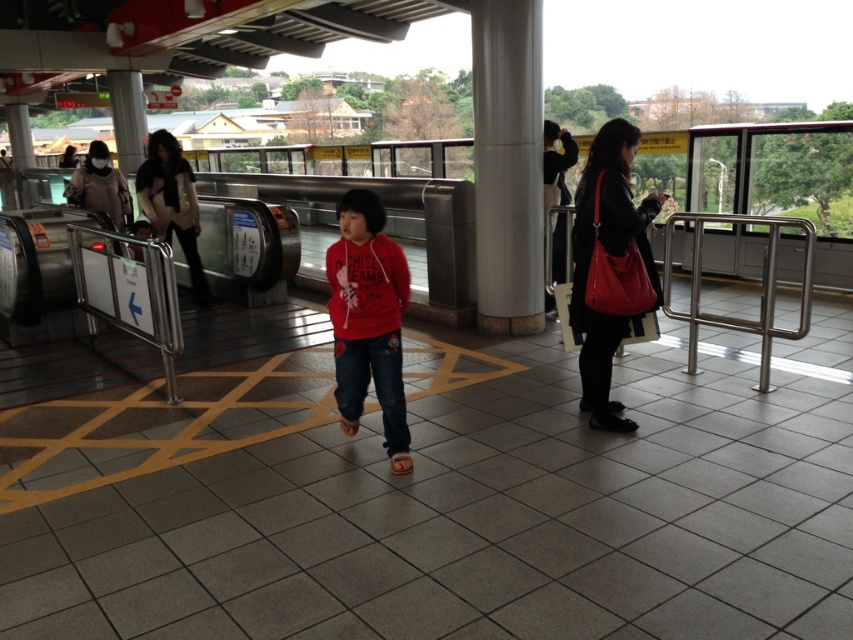
You are at the transportation hub and need to locate the satin silver rail at right and the matte black jacket at upper left. Which object is smaller in size?

The satin silver rail at right has a smaller size compared to the matte black jacket at upper left, so the satin silver rail at right is smaller.

You are a maintenance worker checking the railings in the station. The safety regulations require that all railings must be wider than any nearby jackets to ensure safety. Given the metallic silver rail at left and the matte black jacket at upper left, which one is narrower and thus may not comply with the regulation?

The metallic silver rail at left is narrower than the matte black jacket at upper left, so it may not comply with the regulation.

You are standing at the public transportation hub and see the matte red hoodie at center and the satin silver rail at right. Which object is closer to the ground?

The matte red hoodie at center is closer to the ground because it is located below the satin silver rail at right.